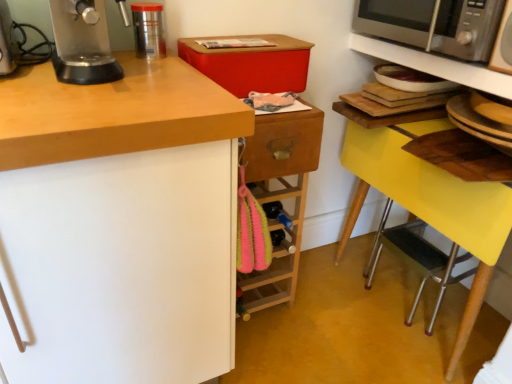
Question: Considering their positions, is satin silver microwave at upper right located in front of or behind yellow plastic step stool at lower right?

Choices:
 (A) front
 (B) behind

Answer: (A)

Question: Is satin silver microwave at upper right taller or shorter than yellow plastic step stool at lower right?

Choices:
 (A) short
 (B) tall

Answer: (B)

Question: Based on their relative distances, which object is nearer to the yellow plastic step stool at lower right?

Choices:
 (A) metallic cylindrical container at upper left
 (B) metallic silver microwave at upper right
 (C) satin silver microwave at upper right
 (D) satin silver microwave at upper right
 (E) yellow wood table at lower right

Answer: (E)

Question: Estimate the real-world distances between objects in this image. Which object is farther from the satin silver microwave at upper right?

Choices:
 (A) metallic silver microwave at upper right
 (B) metallic cylindrical container at upper left
 (C) wooden drawer at center
 (D) yellow plastic step stool at lower right
 (E) satin silver microwave at upper right

Answer: (D)